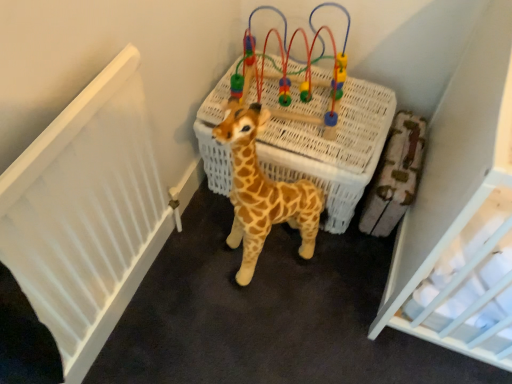
This screenshot has width=512, height=384. What are the coordinates of `free space in front of white wicker basket at center` in the screenshot? It's located at (280, 305).